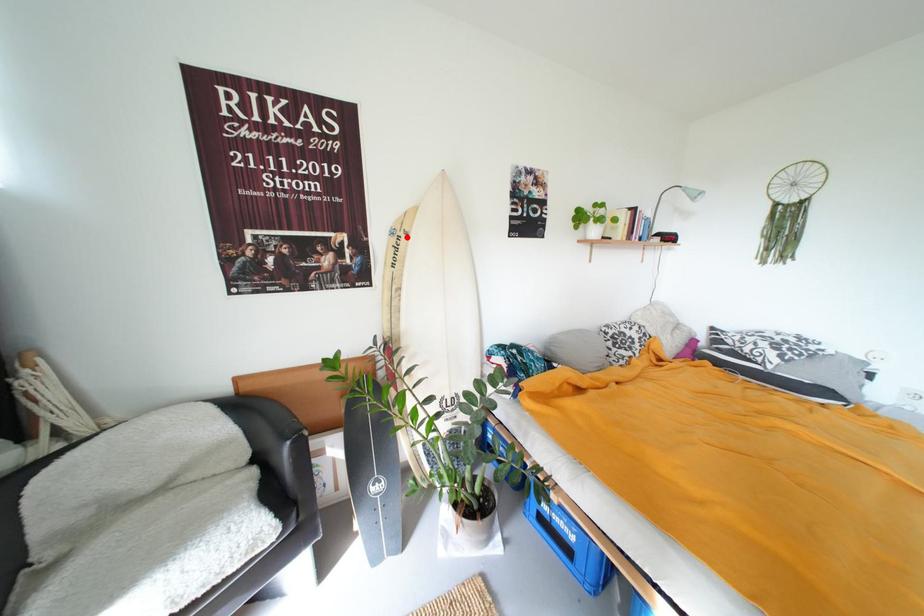
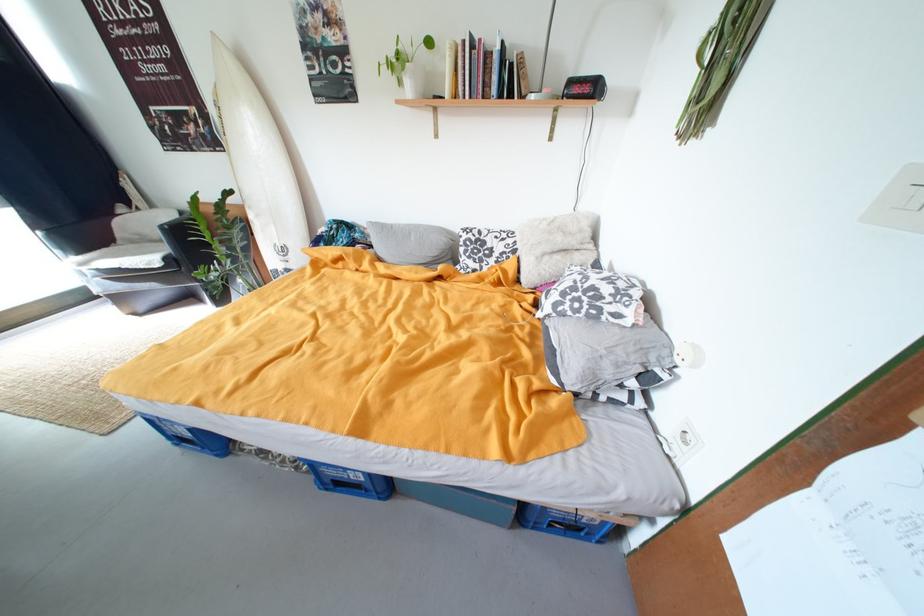
In the second image, find the point that corresponds to the highlighted location in the first image.

(225, 108)